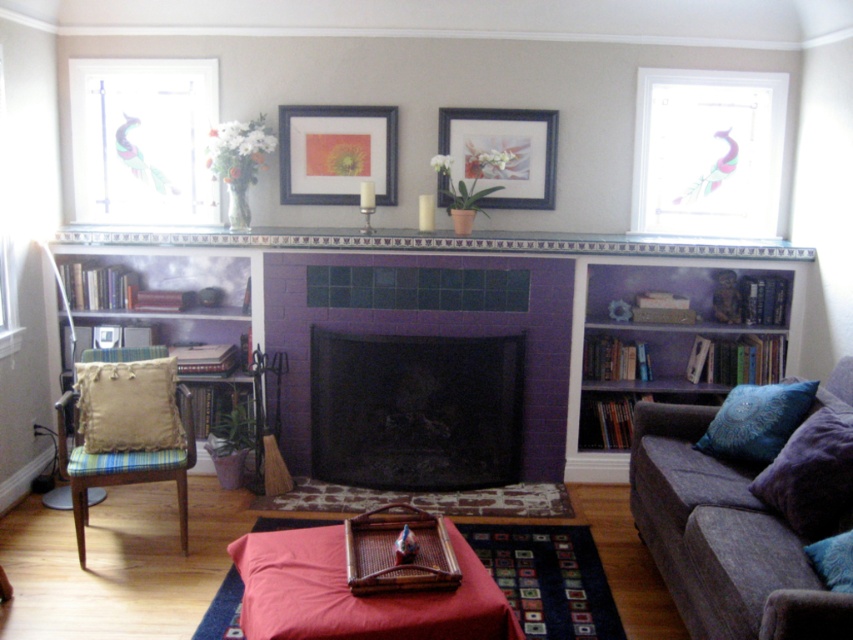
At what (x,y) coordinates should I click in order to perform the action: click on purple matte bookshelf at right. Please return your answer as a coordinate pair (x, y). This screenshot has width=853, height=640. Looking at the image, I should click on (660, 339).

Which of these two, purple matte bookshelf at right or stained glass peacock at upper left, stands shorter?

Standing shorter between the two is stained glass peacock at upper left.

Describe the element at coordinates (660, 339) in the screenshot. The width and height of the screenshot is (853, 640). I see `purple matte bookshelf at right` at that location.

Find the location of a particular element. This screenshot has width=853, height=640. purple matte bookshelf at right is located at coordinates (660, 339).

Can you confirm if black mesh fireplace at center is positioned above purple matte bookshelf at right?

No.

Is point (415, 460) positioned before point (762, 376)?

Yes, point (415, 460) is in front of point (762, 376).

Where is `black mesh fireplace at center`? This screenshot has width=853, height=640. black mesh fireplace at center is located at coordinates (415, 410).

Where is `black mesh fireplace at center`? black mesh fireplace at center is located at coordinates (415, 410).

In the scene shown: Can you confirm if purple tile fireplace at center is smaller than blue textured pillow at lower right?

No, purple tile fireplace at center is not smaller than blue textured pillow at lower right.

Can you confirm if purple tile fireplace at center is wider than blue textured pillow at lower right?

Yes.

You are a GUI agent. You are given a task and a screenshot of the screen. Output one action in this format:
    pyautogui.click(x=<x>, y=<y>)
    Task: Click on the purple tile fireplace at center
    
    Given the screenshot: What is the action you would take?
    (x=428, y=333)